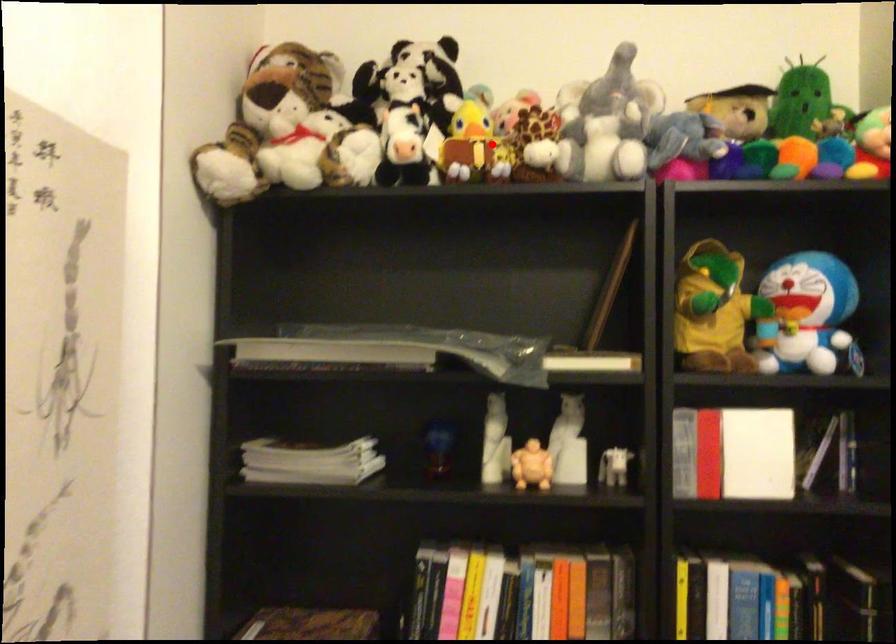
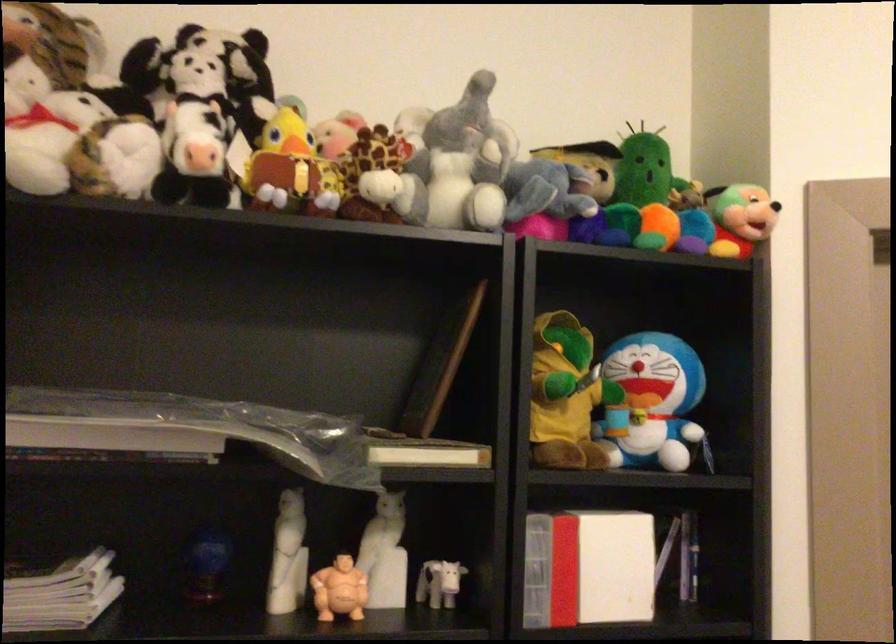
Where in the second image is the point corresponding to the highlighted location from the first image?

(316, 169)